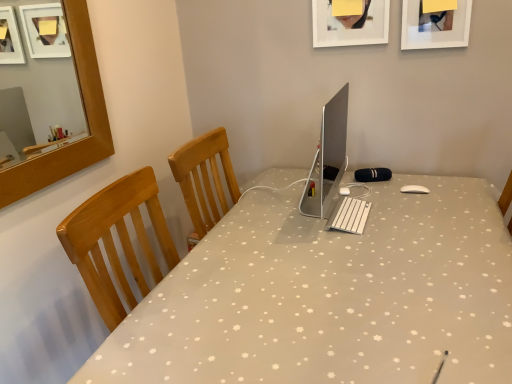
Identify the location of free space in front of silver metallic computer monitor at center. This screenshot has width=512, height=384. (348, 255).